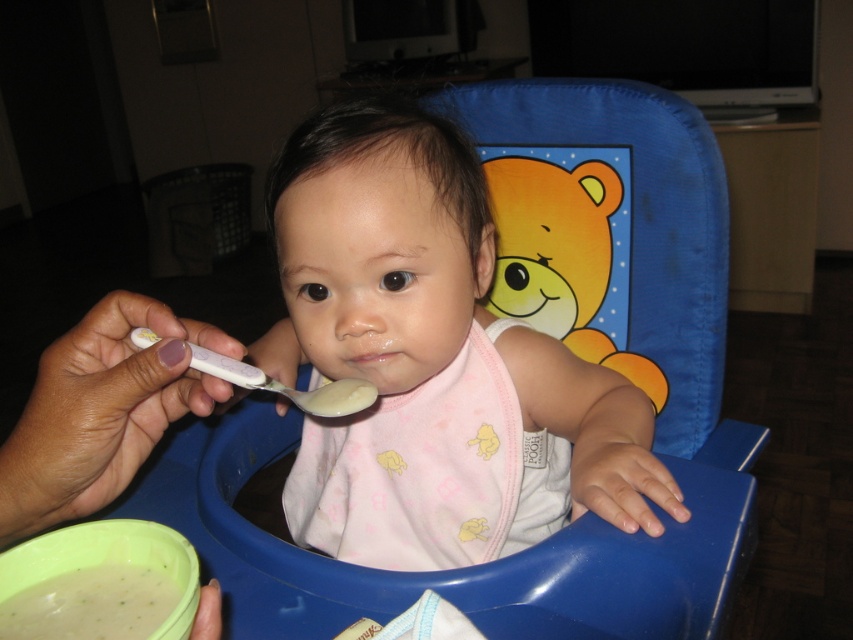
Question: Can you confirm if pink fabric bib at center is positioned to the right of green creamy soup at lower left?

Choices:
 (A) no
 (B) yes

Answer: (B)

Question: Which object is positioned closest to the white plastic spoon at center?

Choices:
 (A) pink fabric bib at center
 (B) green creamy soup at lower left

Answer: (B)

Question: From the image, what is the correct spatial relationship of pink fabric bib at center in relation to white plastic spoon at center?

Choices:
 (A) above
 (B) below

Answer: (A)

Question: Which of the following is the closest to the observer?

Choices:
 (A) (260, 378)
 (B) (119, 577)
 (C) (387, 518)

Answer: (B)

Question: Is pink fabric bib at center below white plastic spoon at center?

Choices:
 (A) yes
 (B) no

Answer: (B)

Question: Which object is closer to the camera taking this photo?

Choices:
 (A) white plastic spoon at center
 (B) green creamy soup at lower left

Answer: (B)